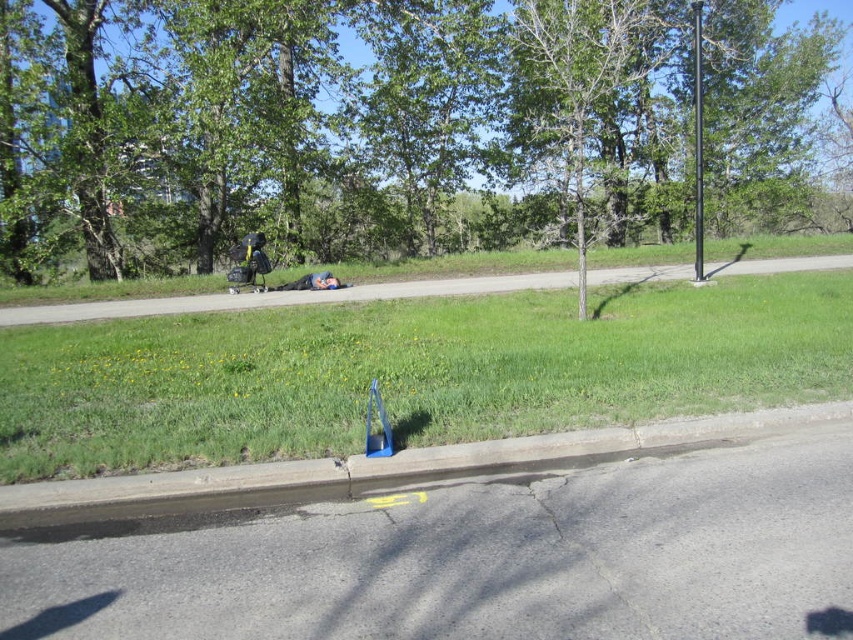
Can you confirm if blue plastic curb at lower left is smaller than black metal pole at center right?

Correct, blue plastic curb at lower left occupies less space than black metal pole at center right.

Who is more distant from viewer, (399, 465) or (700, 150)?

Positioned behind is point (700, 150).

Locate an element on the screen. The height and width of the screenshot is (640, 853). blue plastic curb at lower left is located at coordinates (381, 468).

Does green grass at lower center have a lesser width compared to black metal pole at center right?

In fact, green grass at lower center might be wider than black metal pole at center right.

Looking at this image, who is more distant from viewer, (486, 412) or (694, 248)?

Point (694, 248)

Find the location of a particular element. The image size is (853, 640). green grass at lower center is located at coordinates (409, 371).

Can you confirm if green leafy tree at upper center is positioned above blue plastic curb at lower left?

Correct, green leafy tree at upper center is located above blue plastic curb at lower left.

Is green leafy tree at upper center further to the viewer compared to blue plastic curb at lower left?

Yes, green leafy tree at upper center is further from the viewer.

Does point (161, 216) lie behind point (743, 433)?

Yes, point (161, 216) is farther from viewer.

Image resolution: width=853 pixels, height=640 pixels. What are the coordinates of `green leafy tree at upper center` in the screenshot? It's located at (337, 131).